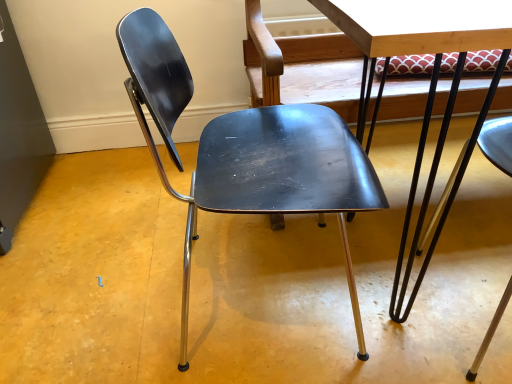
Question: From the image's perspective, is metallic/smooth table at center below matte black chair at center?

Choices:
 (A) no
 (B) yes

Answer: (A)

Question: Are metallic/smooth table at center and matte black chair at center located far from each other?

Choices:
 (A) yes
 (B) no

Answer: (B)

Question: Is matte black chair at center at the back of metallic/smooth table at center?

Choices:
 (A) no
 (B) yes

Answer: (A)

Question: Is metallic/smooth table at center outside matte black chair at center?

Choices:
 (A) yes
 (B) no

Answer: (A)

Question: Is metallic/smooth table at center aimed at matte black chair at center?

Choices:
 (A) no
 (B) yes

Answer: (A)

Question: Does metallic/smooth table at center have a smaller size compared to matte black chair at center?

Choices:
 (A) yes
 (B) no

Answer: (B)

Question: From the image's perspective, is matte black chair at center beneath metallic/smooth table at center?

Choices:
 (A) yes
 (B) no

Answer: (A)

Question: Is matte black chair at center next to metallic/smooth table at center?

Choices:
 (A) yes
 (B) no

Answer: (B)

Question: Does matte black chair at center have a lesser width compared to metallic/smooth table at center?

Choices:
 (A) yes
 (B) no

Answer: (A)

Question: Can you confirm if matte black chair at center is smaller than metallic/smooth table at center?

Choices:
 (A) yes
 (B) no

Answer: (A)

Question: Is matte black chair at center behind metallic/smooth table at center?

Choices:
 (A) yes
 (B) no

Answer: (A)

Question: Can you confirm if matte black chair at center is wider than metallic/smooth table at center?

Choices:
 (A) yes
 (B) no

Answer: (B)

Question: Relative to metallic/smooth table at center, is matte black chair at center in front or behind?

Choices:
 (A) front
 (B) behind

Answer: (B)